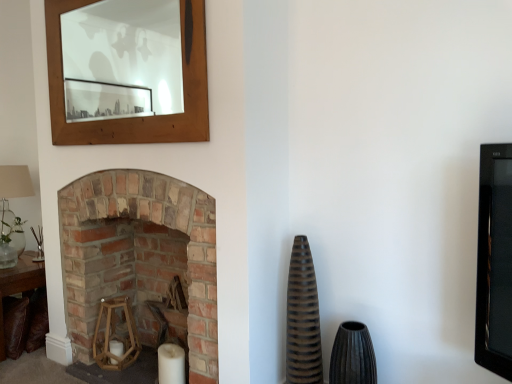
Question: Is point (288, 362) closer or farther from the camera than point (2, 334)?

Choices:
 (A) closer
 (B) farther

Answer: (A)

Question: Considering the relative positions of brown ribbed vase at center-right, the 1th vase viewed from the left, and brown leather table at lower left in the image provided, is brown ribbed vase at center-right, the 1th vase viewed from the left, to the left or to the right of brown leather table at lower left?

Choices:
 (A) right
 (B) left

Answer: (A)

Question: Estimate the real-world distances between objects in this image. Which object is farther from the matte brown vase at center-right, which ranks as the first vase in right-to-left order?

Choices:
 (A) wooden hexagonal candle holder at lower left
 (B) wooden frame at upper left
 (C) brown leather table at lower left
 (D) translucent glass lampshade at left
 (E) brown ribbed vase at center-right, the 1th vase viewed from the left

Answer: (B)

Question: Estimate the real-world distances between objects in this image. Which object is closer to the translucent glass lampshade at left?

Choices:
 (A) brick fireplace at left
 (B) wooden frame at upper left
 (C) brown ribbed vase at center-right, which is counted as the second vase, starting from the right
 (D) matte brown vase at center-right, which is counted as the second vase, starting from the left
 (E) wooden hexagonal candle holder at lower left

Answer: (E)